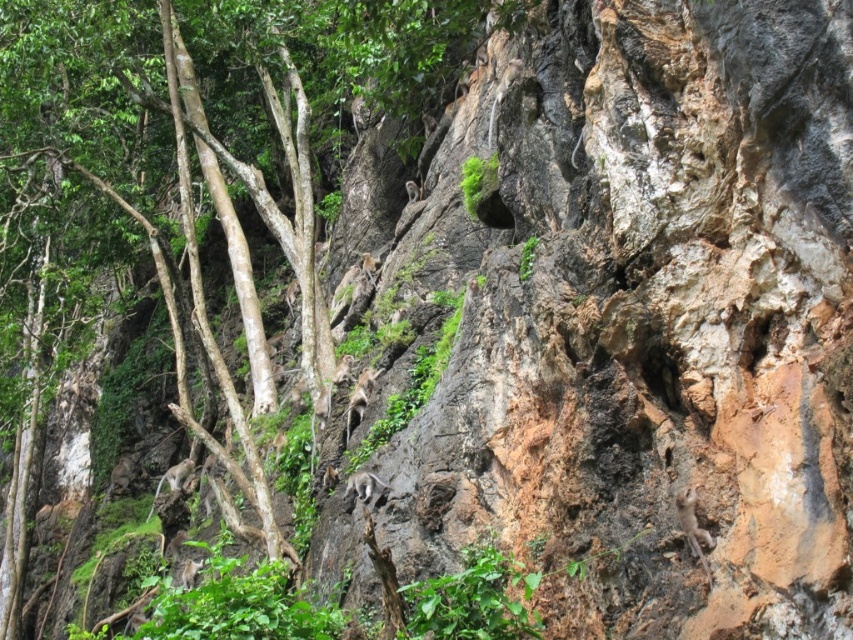
Who is more distant from viewer, (769, 230) or (262, 513)?

Positioned behind is point (262, 513).

The width and height of the screenshot is (853, 640). Find the location of `brown rough rock at upper center`. brown rough rock at upper center is located at coordinates (647, 323).